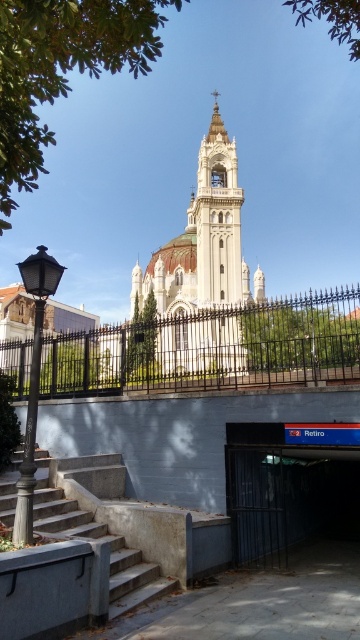
You are standing in front of the church and need to enter the subway passage. Which object, the dark blue concrete entrance at lower center or the concrete stairs at lower left, is taller and would require looking up more to see its top?

The dark blue concrete entrance at lower center is much taller than the concrete stairs at lower left, so you would need to look up more to see its top.

You are standing in front of the church and want to locate the point at coordinates [203,268]. Where exactly on the church would you find this point?

The point at coordinates [203,268] is located on the white stone tower at center of the church.

You are standing in front of the church and want to enter the subway entrance. Which object must you pass through first, the black wrought iron fence at center or the dark blue concrete entrance at lower center?

The black wrought iron fence at center is above the dark blue concrete entrance at lower center, so you must pass through the dark blue concrete entrance at lower center first before reaching the subway entrance.